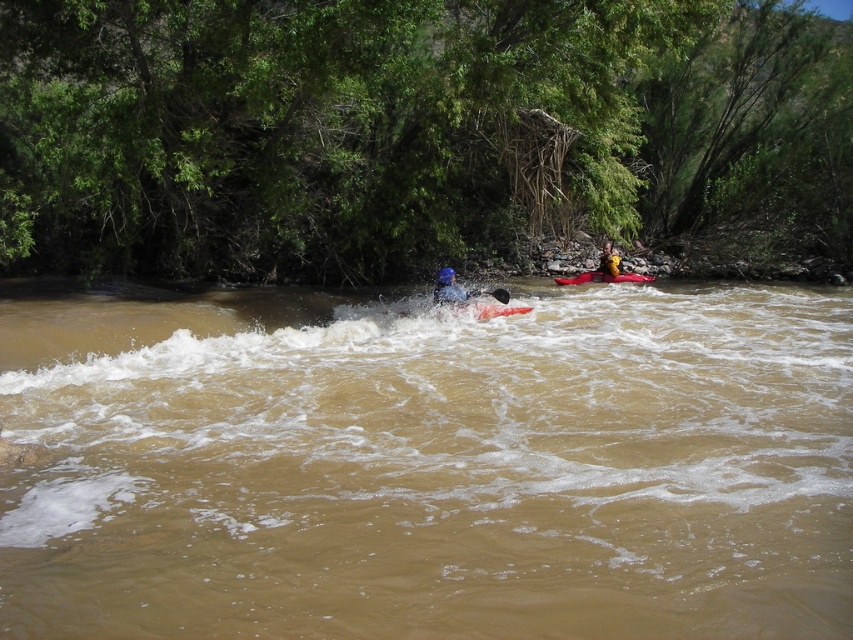
Consider the image. You are a safety officer assessing the scene. You see the brown muddy water at center and the matte blue kayak at center. Which object takes up more space in the image?

The brown muddy water at center is bigger than the matte blue kayak at center, so it takes up more space in the image.

You are a rafting guide assessing the scene. You see the brown muddy water at center and the matte blue kayak at center. Which object is located to the left of the other?

The brown muddy water at center is positioned on the left side of matte blue kayak at center.

You are a safety officer assessing the rafting scene. You notice the brown muddy water at center and the yellow fabric life jacket at center. Which object is wider in this image?

The brown muddy water at center is wider than the yellow fabric life jacket at center.